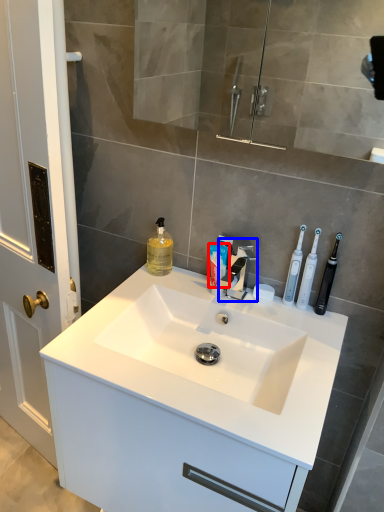
Question: Which of the following is the farthest to the observer, toothpaste (highlighted by a red box) or tap (highlighted by a blue box)?

Choices:
 (A) toothpaste
 (B) tap

Answer: (A)